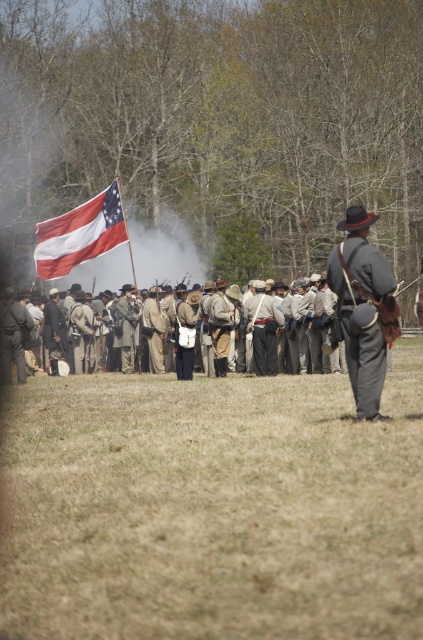
Measure the distance between red-white striped flag at center-left and camera.

red-white striped flag at center-left is 22.84 meters from camera.

Identify the location of red-white striped flag at center-left. The width and height of the screenshot is (423, 640). (79, 234).

At what (x,y) coordinates should I click in order to perform the action: click on red-white striped flag at center-left. Please return your answer as a coordinate pair (x, y). This screenshot has height=640, width=423. Looking at the image, I should click on (79, 234).

Is point (40, 333) closer to camera compared to point (217, 310)?

No.

What do you see at coordinates (54, 358) in the screenshot?
I see `light brown fabric uniform at center` at bounding box center [54, 358].

Find the location of a particular element. This screenshot has width=423, height=640. light brown fabric uniform at center is located at coordinates (54, 358).

You are a GUI agent. You are given a task and a screenshot of the screen. Output one action in this format:
    pyautogui.click(x=<x>, y=<y>)
    Task: Click on the light brown fabric uniform at center
    The image size is (423, 640).
    Given the screenshot: What is the action you would take?
    pyautogui.click(x=54, y=358)

Does red-white striped flag at center-left appear on the left side of light brown fabric uniform at center?

Yes, red-white striped flag at center-left is to the left of light brown fabric uniform at center.

Is red-white striped flag at center-left above light brown fabric uniform at center?

Yes.

Who is more forward, (x=125, y=232) or (x=10, y=380)?

Point (x=10, y=380) is in front.

Locate an element on the screen. This screenshot has width=423, height=640. red-white striped flag at center-left is located at coordinates (79, 234).